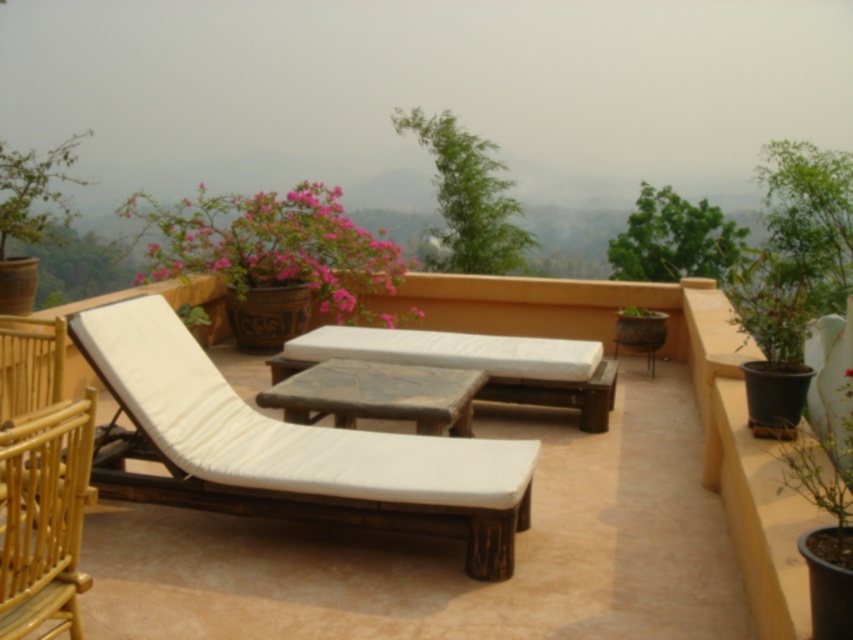
Who is taller, pink matte flower pot at upper left or wooden table at center?

pink matte flower pot at upper left

Between pink matte flower pot at upper left and wooden table at center, which one is positioned higher?

Positioned higher is pink matte flower pot at upper left.

Between point (173, 252) and point (363, 358), which one is positioned behind?

The point (173, 252) is more distant.

Identify the location of pink matte flower pot at upper left. (271, 248).

Can you confirm if white wood chaise lounge at center is positioned to the right of wooden table at center?

Incorrect, white wood chaise lounge at center is not on the right side of wooden table at center.

What do you see at coordinates (292, 449) in the screenshot? This screenshot has height=640, width=853. I see `white wood chaise lounge at center` at bounding box center [292, 449].

The width and height of the screenshot is (853, 640). Identify the location of white wood chaise lounge at center. (292, 449).

Who is positioned more to the right, wooden lounge chair at center or light brown woven armchair at lower left?

wooden lounge chair at center is more to the right.

Is wooden lounge chair at center shorter than light brown woven armchair at lower left?

Indeed, wooden lounge chair at center has a lesser height compared to light brown woven armchair at lower left.

Between point (378, 593) and point (27, 548), which one is positioned behind?

The point (378, 593) is behind.

Find the location of a particular element. Image resolution: width=853 pixels, height=640 pixels. wooden lounge chair at center is located at coordinates (691, 419).